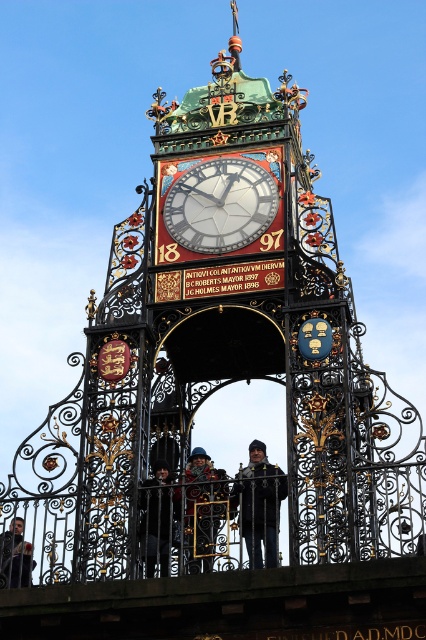
Question: Is wrought iron gate at center behind matte black clock at center?

Choices:
 (A) yes
 (B) no

Answer: (B)

Question: Does dark blue fabric jacket at center lie behind dark gray fabric jacket at center?

Choices:
 (A) no
 (B) yes

Answer: (A)

Question: Which point is closer to the camera?

Choices:
 (A) matte black clock at center
 (B) dark blue fabric coat at center
 (C) dark gray fabric jacket at center

Answer: (B)

Question: Which object appears farthest from the camera in this image?

Choices:
 (A) dark gray fabric jacket at center
 (B) matte black clock at center

Answer: (B)

Question: Estimate the real-world distances between objects in this image. Which object is farther from the dark gray jacket at lower left?

Choices:
 (A) wrought iron gate at center
 (B) dark blue fabric coat at center
 (C) matte black clock at center
 (D) dark gray fabric jacket at center

Answer: (C)

Question: Is dark blue fabric coat at center bigger than dark gray jacket at lower left?

Choices:
 (A) yes
 (B) no

Answer: (A)